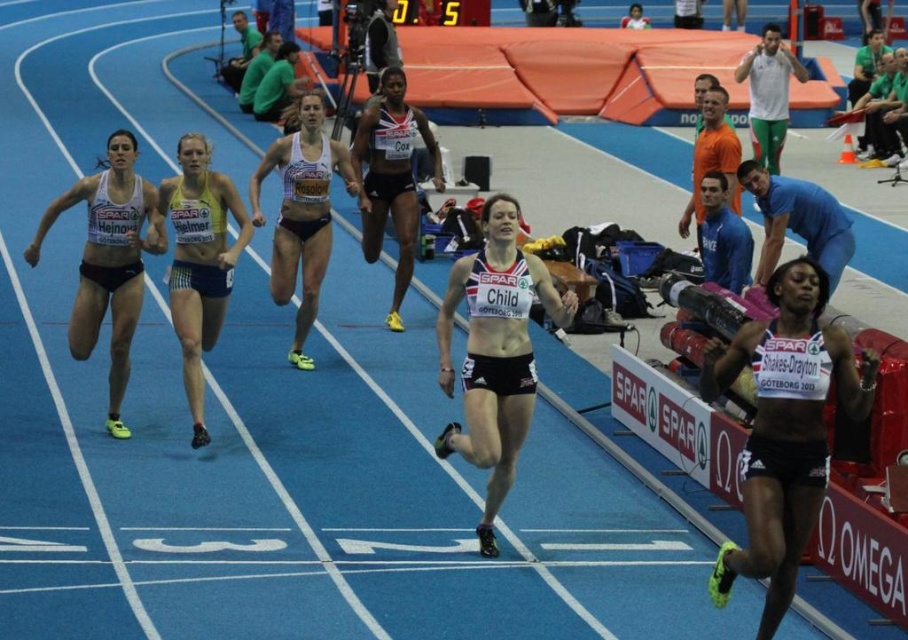
You are a photographer standing at the camera position. You want to capture a closeup shot of the point at coordinates (486, 552). Considering your current distance, can you get a clear closeup without moving closer than 20 feet?

The point at coordinates (486, 552) is 24.87 feet away from the camera. Since 24.87 feet is more than 20 feet, you can get a clear closeup without moving closer than 20 feet.

You are a photographer positioned at the starting line of the indoor track. You notice two athletes wearing a matte white tank top at center and a blue cotton shirt at upper right. Which athlete is closer to the camera based on their clothing visibility?

The matte white tank top at center is taller than the blue cotton shirt at upper right, meaning the athlete wearing the matte white tank top at center is closer to the camera since objects closer to the camera appear larger.